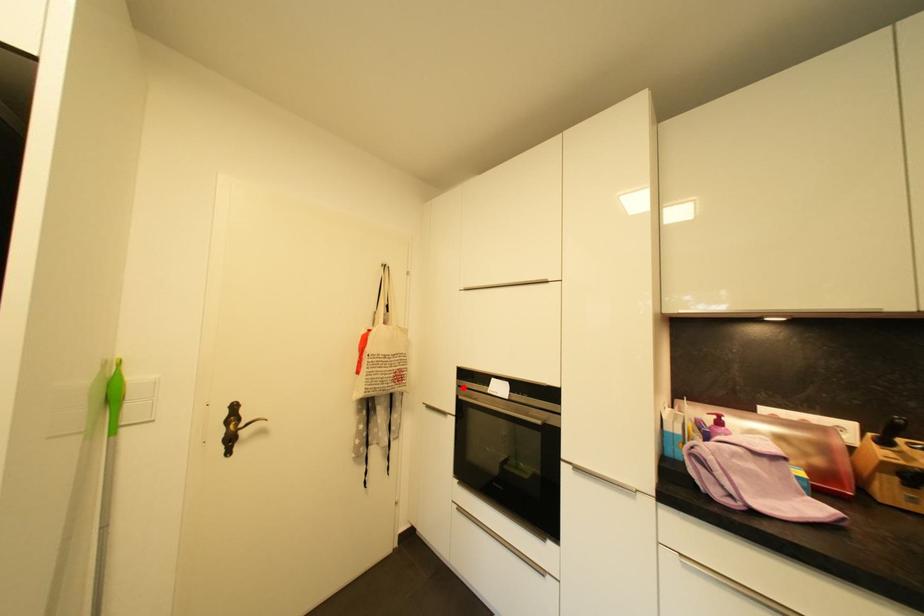
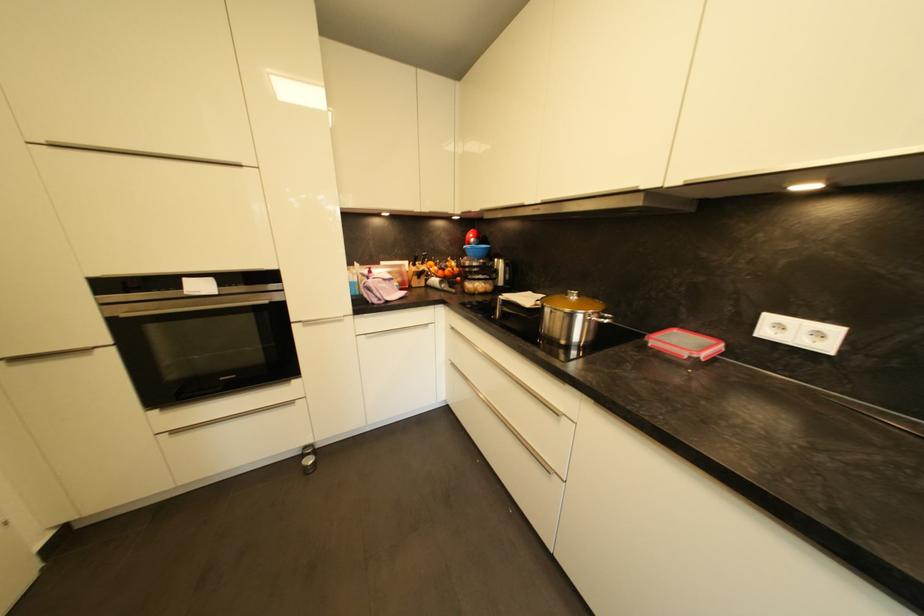
The point at the highlighted location is marked in the first image. Where is the corresponding point in the second image?

(107, 307)